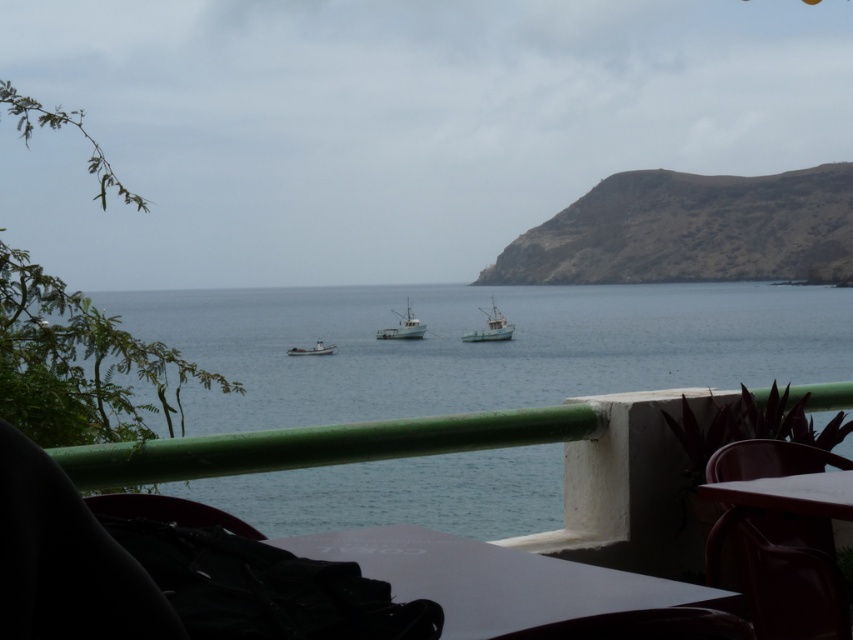
Who is shorter, matte plastic chair at lower right or black leather chair at lower left?

With less height is black leather chair at lower left.

Between point (809, 461) and point (242, 529), which one is positioned behind?

Point (809, 461)

Locate an element on the screen. The image size is (853, 640). matte plastic chair at lower right is located at coordinates (769, 460).

Between matte plastic chair at lower right and white wooden boat at center, which one is positioned higher?

white wooden boat at center is above.

Image resolution: width=853 pixels, height=640 pixels. What do you see at coordinates (769, 460) in the screenshot?
I see `matte plastic chair at lower right` at bounding box center [769, 460].

The image size is (853, 640). I want to click on matte plastic chair at lower right, so click(769, 460).

The height and width of the screenshot is (640, 853). What are the coordinates of `white glossy table at lower center` in the screenshot? It's located at (494, 579).

Between point (438, 548) and point (326, 349), which one is positioned in front?

Positioned in front is point (438, 548).

At what (x,y) coordinates should I click in order to perform the action: click on white glossy table at lower center. Please return your answer as a coordinate pair (x, y). Looking at the image, I should click on (494, 579).